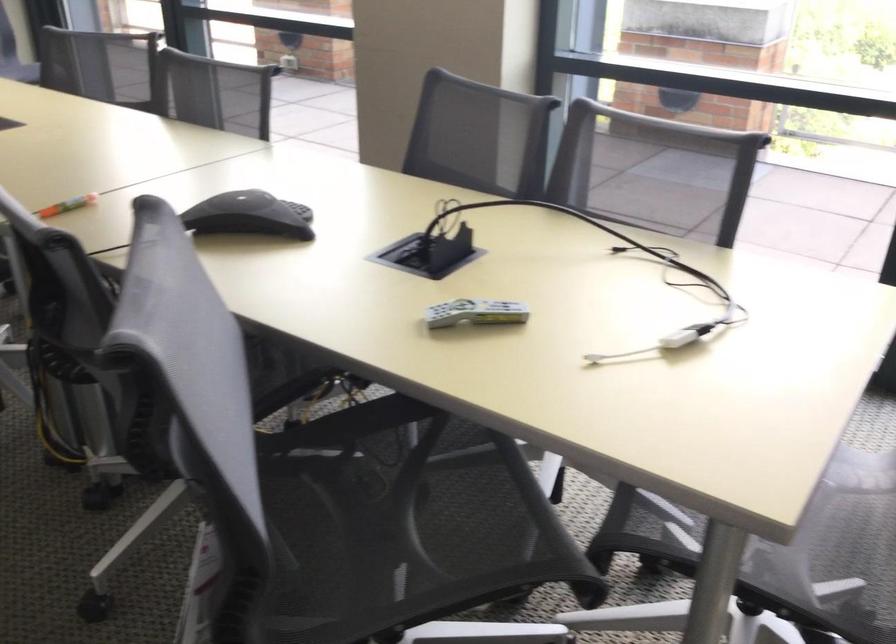
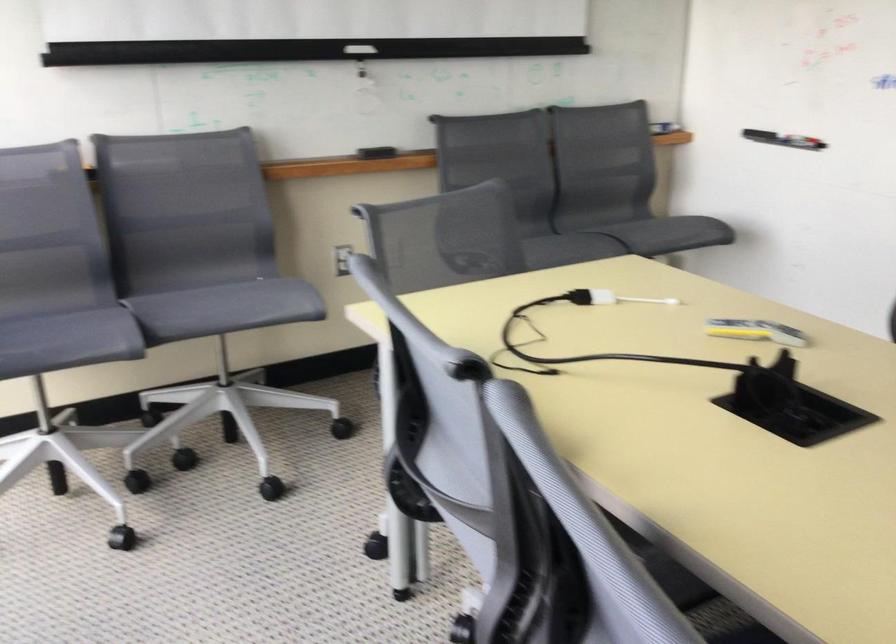
Find the pixel in the second image that matches [655,355] in the first image.

(610, 298)